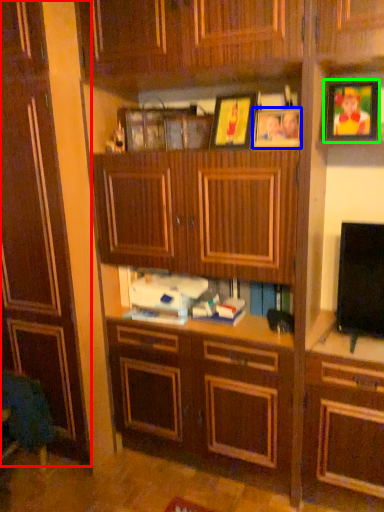
Question: Considering the real-world distances, which object is farthest from cabinetry (highlighted by a red box)? picture frame (highlighted by a blue box) or picture frame (highlighted by a green box)?

Choices:
 (A) picture frame
 (B) picture frame

Answer: (B)